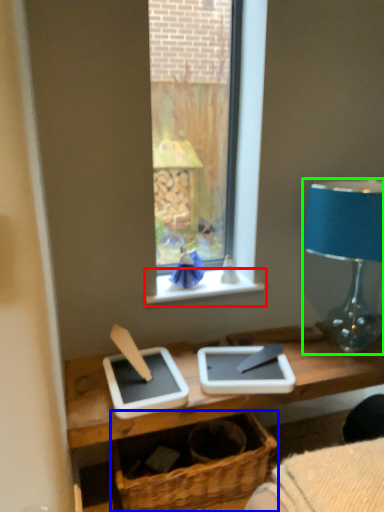
Question: Which is nearer to the window sill (highlighted by a red box)? basket (highlighted by a blue box) or lamp (highlighted by a green box).

Choices:
 (A) basket
 (B) lamp

Answer: (B)